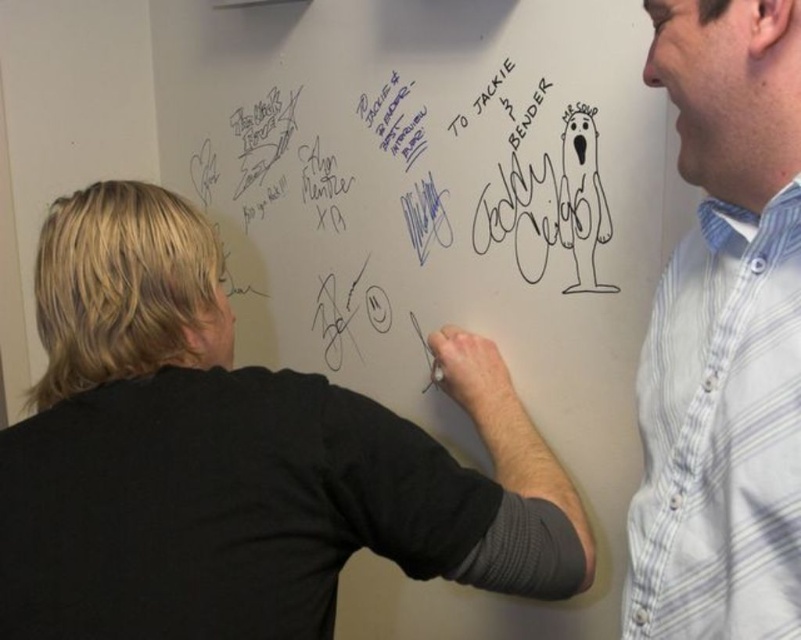
From the picture: Does black shirt at left lie in front of black marker writing at upper center?

Yes, black shirt at left is closer to the viewer.

In the scene shown: Who is more distant from viewer, (49, 275) or (445, 109)?

The point (445, 109) is more distant.

Is point (477, 385) closer to viewer compared to point (264, 228)?

Yes, point (477, 385) is in front of point (264, 228).

Find the location of a particular element. black shirt at left is located at coordinates (236, 458).

Does black marker writing at upper center have a greater height compared to white striped shirt at upper right?

In fact, black marker writing at upper center may be shorter than white striped shirt at upper right.

Between point (308, 296) and point (717, 296), which one is positioned behind?

Point (308, 296)

Where is `black marker writing at upper center`? The width and height of the screenshot is (801, 640). black marker writing at upper center is located at coordinates (409, 208).

Between black shirt at left and white striped shirt at upper right, which one is positioned lower?

black shirt at left is lower down.

Is black shirt at left below white striped shirt at upper right?

Indeed, black shirt at left is positioned under white striped shirt at upper right.

Is point (143, 228) closer to camera compared to point (723, 316)?

No, it is not.

Where is `black shirt at left`? The width and height of the screenshot is (801, 640). black shirt at left is located at coordinates (236, 458).